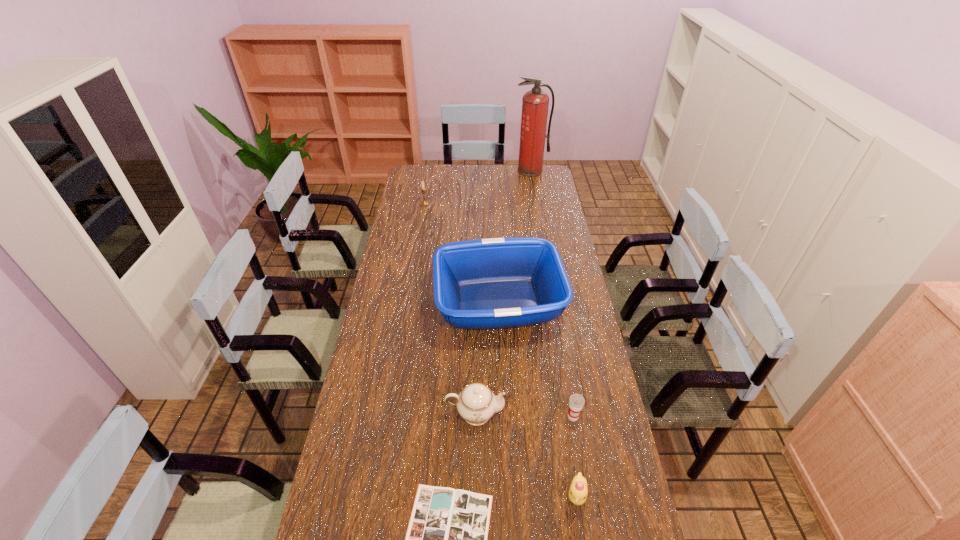
Locate an element on the screen. The width and height of the screenshot is (960, 540). fire extinguisher is located at coordinates (535, 103).

Locate an element on the screen. the farthest object is located at coordinates (535, 103).

Locate an element on the screen. tray is located at coordinates (492, 283).

Find the location of a particular element. Image resolution: width=960 pixels, height=540 pixels. the third farthest object is located at coordinates (492, 283).

This screenshot has width=960, height=540. In order to click on the second farthest object in this screenshot , I will do `click(423, 203)`.

Find the location of a particular element. The height and width of the screenshot is (540, 960). candle holder is located at coordinates (423, 203).

In order to click on cup in this screenshot , I will do `click(576, 401)`.

This screenshot has width=960, height=540. In order to click on chinaware in this screenshot , I will do `click(476, 403)`.

In order to click on the second shortest object in this screenshot , I will do `click(578, 491)`.

At what (x,y) coordinates should I click in order to perform the action: click on vacant space located at the nozzle of the fire extinguisher. Please return your answer as a coordinate pair (x, y). Looking at the image, I should click on (539, 216).